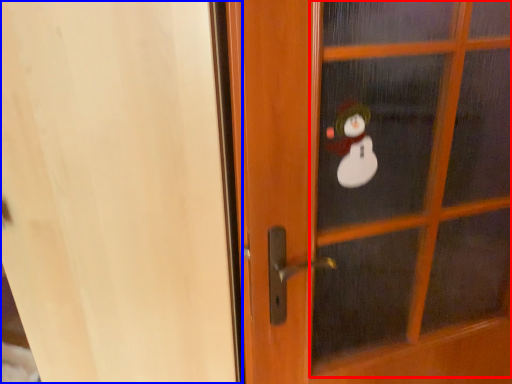
Question: Among these objects, which one is nearest to the camera, screen door (highlighted by a red box) or screen door (highlighted by a blue box)?

Choices:
 (A) screen door
 (B) screen door

Answer: (B)